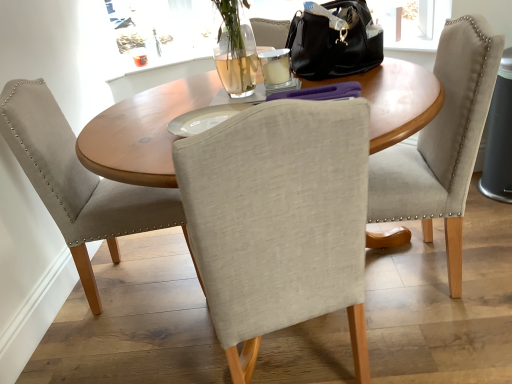
Locate an element on the screen. vacant region below light gray fabric chair at center, which appears as the 1th chair when viewed from the right (from a real-world perspective) is located at coordinates (409, 265).